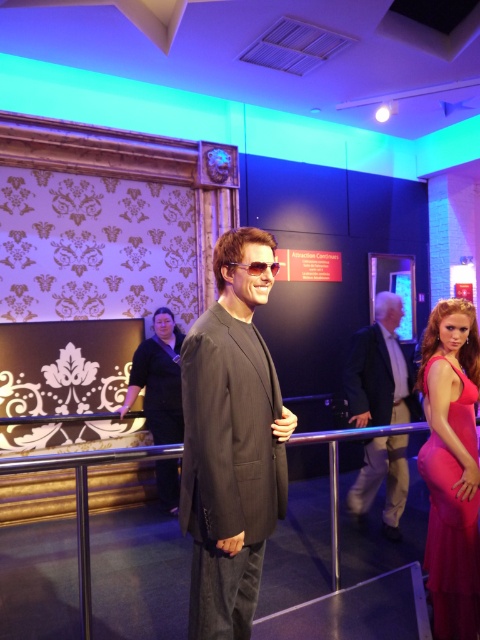
Is point (376, 346) more distant than point (149, 376)?

No, (376, 346) is in front of (149, 376).

Between point (414, 404) and point (134, 353), which one is positioned behind?

Point (134, 353)

Identify the location of dark gray suit at center. The height and width of the screenshot is (640, 480). (379, 369).

Where is `matte pink dress at right`? The height and width of the screenshot is (640, 480). matte pink dress at right is located at coordinates click(x=451, y=545).

Who is lower down, matte pink dress at right or black fabric dress at center?

matte pink dress at right is lower down.

What do you see at coordinates (451, 545) in the screenshot?
I see `matte pink dress at right` at bounding box center [451, 545].

Locate an element on the screen. matte pink dress at right is located at coordinates (451, 545).

Is point (345, 387) closer to camera compared to point (254, 273)?

That is False.

Does dark gray suit at center have a lesser height compared to sunglasses at center?

In fact, dark gray suit at center may be taller than sunglasses at center.

This screenshot has height=640, width=480. I want to click on dark gray suit at center, so click(379, 369).

You are a GUI agent. You are given a task and a screenshot of the screen. Output one action in this format:
    pyautogui.click(x=<x>, y=<y>)
    Task: Click on the dark gray suit at center
    Image resolution: width=480 pixels, height=640 pixels.
    Given the screenshot: What is the action you would take?
    pyautogui.click(x=379, y=369)